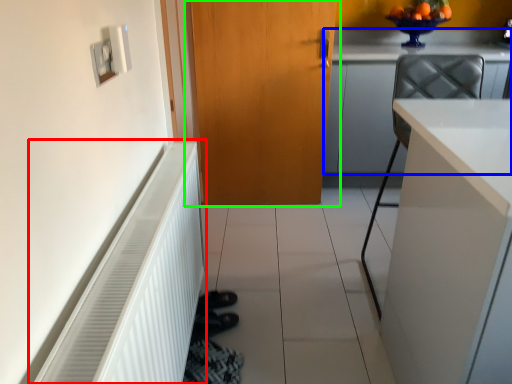
Question: Based on their relative distances, which object is nearer to radiator (highlighted by a red box)? Choose from cabinetry (highlighted by a blue box) and door (highlighted by a green box).

Choices:
 (A) cabinetry
 (B) door

Answer: (B)